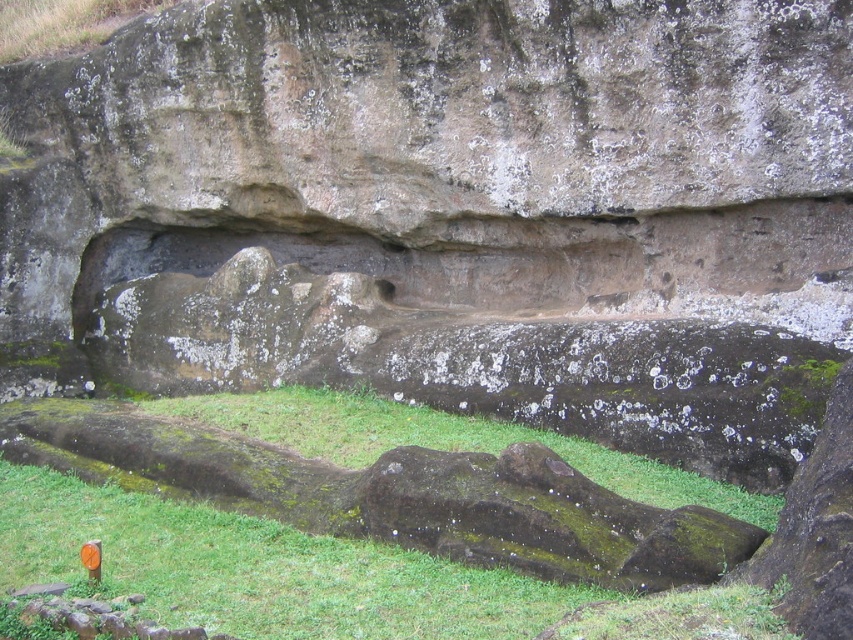
Question: Considering the relative positions of green mossy grass at lower center and green mossy grass at center in the image provided, where is green mossy grass at lower center located with respect to green mossy grass at center?

Choices:
 (A) left
 (B) right

Answer: (A)

Question: Does green mossy grass at lower center have a larger size compared to green mossy grass at center?

Choices:
 (A) no
 (B) yes

Answer: (A)

Question: Does green mossy grass at lower center have a larger size compared to green mossy grass at center?

Choices:
 (A) yes
 (B) no

Answer: (B)

Question: Which point is closer to the camera taking this photo?

Choices:
 (A) (254, 525)
 (B) (280, 426)

Answer: (A)

Question: Which object is farther from the camera taking this photo?

Choices:
 (A) green mossy grass at lower center
 (B) green mossy grass at center

Answer: (B)